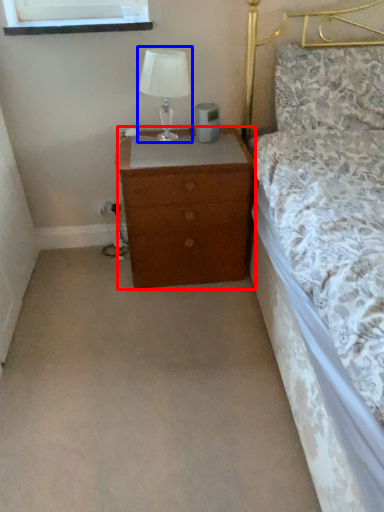
Question: Among these objects, which one is nearest to the camera, chest of drawers (highlighted by a red box) or table lamp (highlighted by a blue box)?

Choices:
 (A) chest of drawers
 (B) table lamp

Answer: (B)